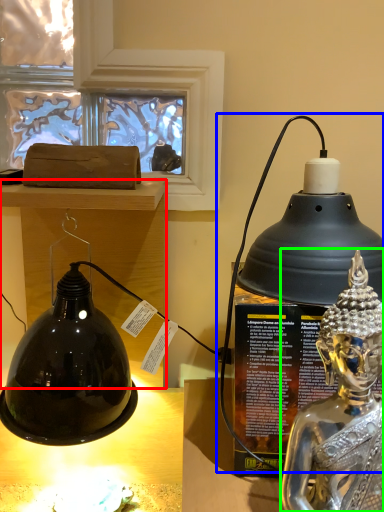
Question: Which object is the farthest from furniture (highlighted by a red box)? Choose among these: oil lamp (highlighted by a blue box) or person (highlighted by a green box).

Choices:
 (A) oil lamp
 (B) person

Answer: (B)